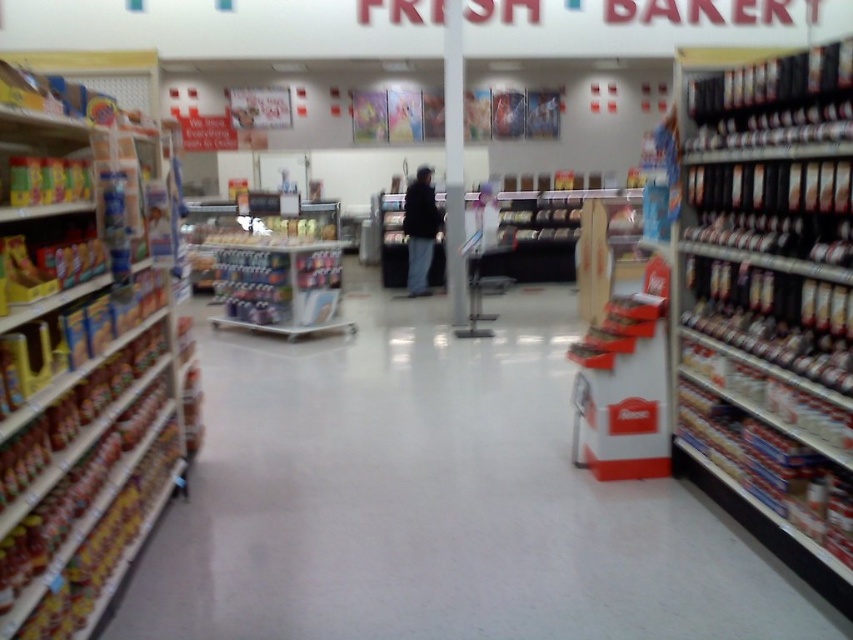
You are a customer in the grocery store and want to grab both the metallic silver cans at right and the black leather jacket at center. However, you notice that one of them is taller than the other. Which object is taller?

The metallic silver cans at right is taller than the black leather jacket at center according to the description.

You are a store employee who needs to place a new large item on the shelf. You see the metallic silver cans at right and the black leather jacket at center. Which object should you choose to place the new item next to if you need space for something bigger than both?

The metallic silver cans at right has a larger size compared to the black leather jacket at center, so you should place the new item next to the metallic silver cans at right since it already takes up more space.